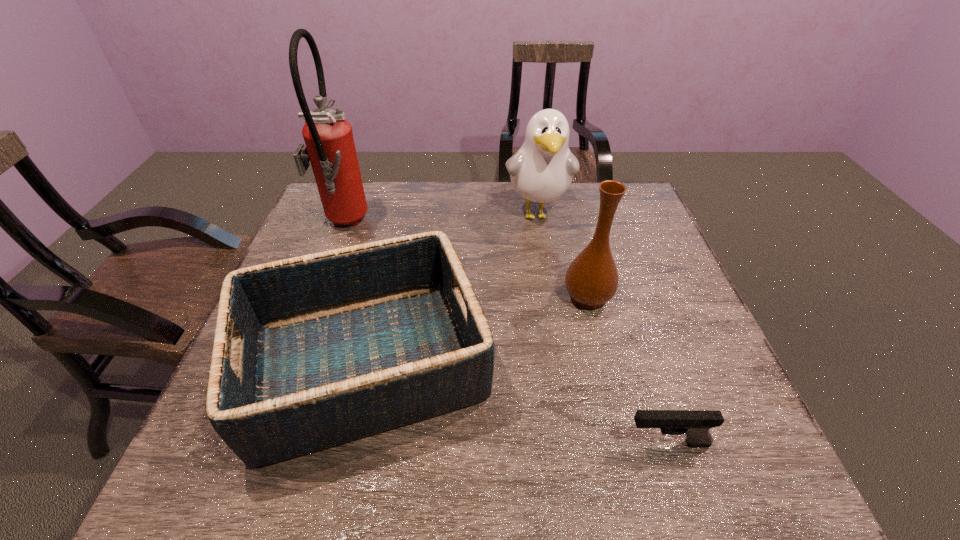
This screenshot has height=540, width=960. I want to click on the tallest object, so click(x=330, y=147).

Locate an element on the screen. Image resolution: width=960 pixels, height=540 pixels. gull is located at coordinates (541, 171).

Identify the location of vase. The image size is (960, 540). (591, 280).

Locate an element on the screen. This screenshot has width=960, height=540. the second shortest object is located at coordinates pyautogui.click(x=326, y=348).

What are the coordinates of `the shortest object` in the screenshot? It's located at (695, 424).

Where is `vacant position located at the nozzle of the fire extinguisher`? vacant position located at the nozzle of the fire extinguisher is located at coordinates (441, 225).

Identify the location of blank area located on the beak of the gull. The image size is (960, 540). (549, 285).

This screenshot has width=960, height=540. I want to click on blank space located on the back of the vase, so click(563, 196).

Find the location of a particular element. vacant area situated on the right of the basket is located at coordinates (603, 363).

Identify the location of vacant region located 0.130m on the front-facing side of the pistol. (554, 443).